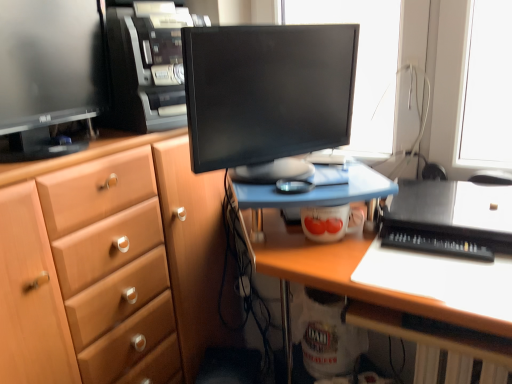
Question: Is black plastic computer tower at upper center looking in the opposite direction of matte black monitor at left, which is the first computer monitor from left to right?

Choices:
 (A) yes
 (B) no

Answer: (B)

Question: From a real-world perspective, is black plastic computer tower at upper center physically below matte black monitor at left, the 2th computer monitor from the right?

Choices:
 (A) no
 (B) yes

Answer: (A)

Question: Is black plastic computer tower at upper center outside of matte black monitor at left, which is the first computer monitor from left to right?

Choices:
 (A) yes
 (B) no

Answer: (A)

Question: From the image's perspective, is black plastic computer tower at upper center beneath matte black monitor at left, which is the first computer monitor from left to right?

Choices:
 (A) yes
 (B) no

Answer: (B)

Question: Considering the relative sizes of black plastic computer tower at upper center and matte black monitor at left, which is the first computer monitor from left to right, in the image provided, is black plastic computer tower at upper center taller than matte black monitor at left, which is the first computer monitor from left to right,?

Choices:
 (A) no
 (B) yes

Answer: (B)

Question: From a real-world perspective, relative to black plastic keyboard at lower right, is matte black monitor at left, which is the first computer monitor from left to right, vertically above or below?

Choices:
 (A) below
 (B) above

Answer: (B)

Question: From the image's perspective, is matte black monitor at left, which is the first computer monitor from left to right, located above or below black plastic keyboard at lower right?

Choices:
 (A) above
 (B) below

Answer: (A)

Question: Considering the positions of matte black monitor at left, which is the first computer monitor from left to right, and black plastic keyboard at lower right in the image, is matte black monitor at left, which is the first computer monitor from left to right, taller or shorter than black plastic keyboard at lower right?

Choices:
 (A) tall
 (B) short

Answer: (A)

Question: Considering the positions of matte black monitor at left, the 2th computer monitor from the right, and black plastic keyboard at lower right in the image, is matte black monitor at left, the 2th computer monitor from the right, wider or thinner than black plastic keyboard at lower right?

Choices:
 (A) wide
 (B) thin

Answer: (A)

Question: Is point (212, 276) positioned closer to the camera than point (426, 241)?

Choices:
 (A) farther
 (B) closer

Answer: (A)

Question: From their relative heights in the image, would you say matte wood cabinet at left is taller or shorter than black plastic keyboard at lower right?

Choices:
 (A) short
 (B) tall

Answer: (B)

Question: In the image, is matte wood cabinet at left on the left side or the right side of black plastic keyboard at lower right?

Choices:
 (A) right
 (B) left

Answer: (B)

Question: From a real-world perspective, is matte wood cabinet at left above or below black plastic keyboard at lower right?

Choices:
 (A) below
 (B) above

Answer: (A)

Question: Considering the positions of point (265, 51) and point (52, 185), is point (265, 51) closer or farther from the camera than point (52, 185)?

Choices:
 (A) closer
 (B) farther

Answer: (B)

Question: From a real-world perspective, is black glossy monitor at center, which is the first computer monitor in right-to-left order, above or below matte wood cabinet at left?

Choices:
 (A) above
 (B) below

Answer: (A)